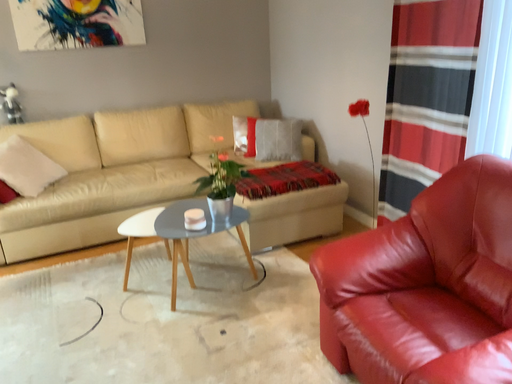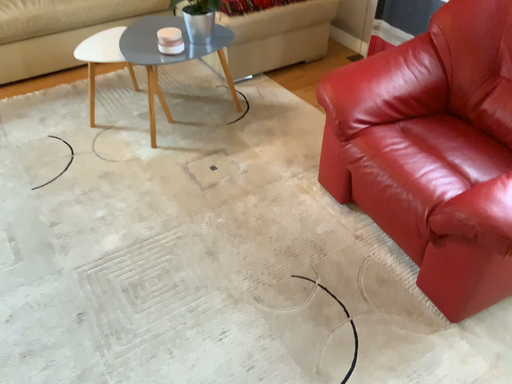
Question: Which way did the camera rotate in the video?

Choices:
 (A) rotated right
 (B) rotated left

Answer: (A)